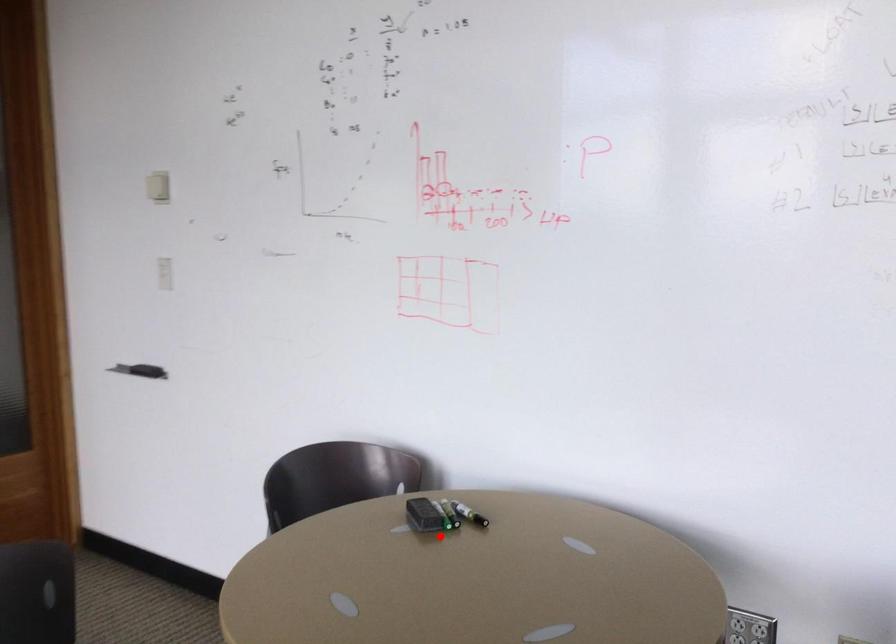
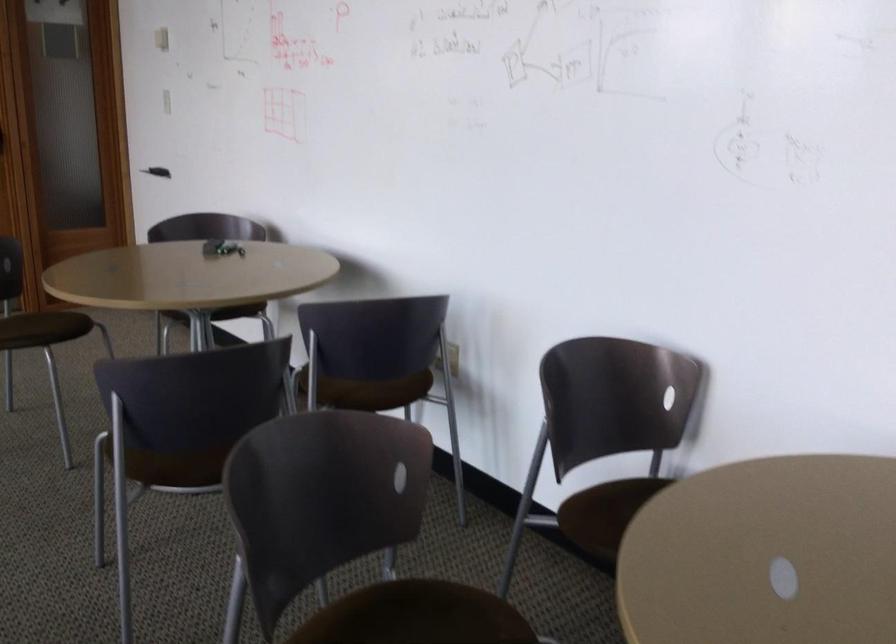
The point at the highlighted location is marked in the first image. Where is the corresponding point in the second image?

(221, 248)